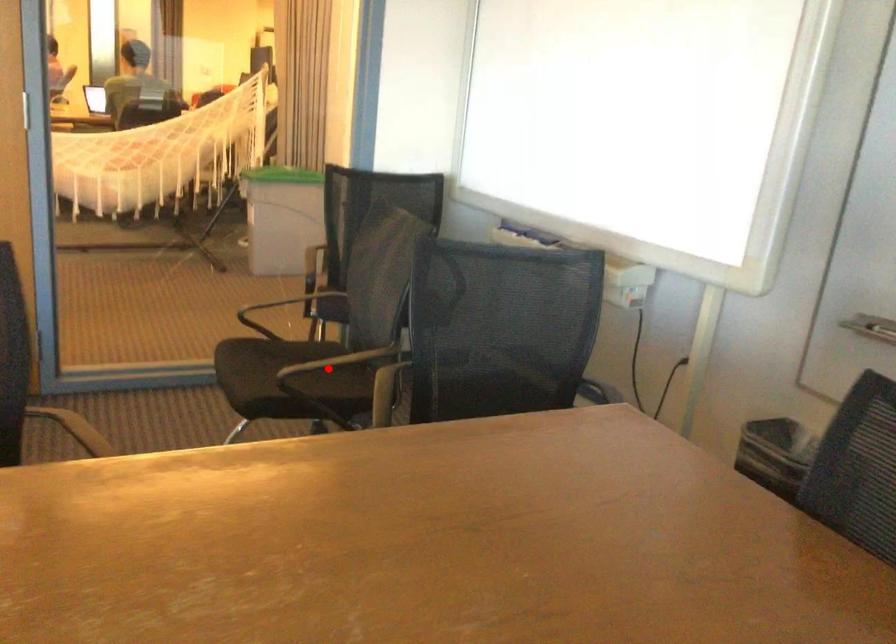
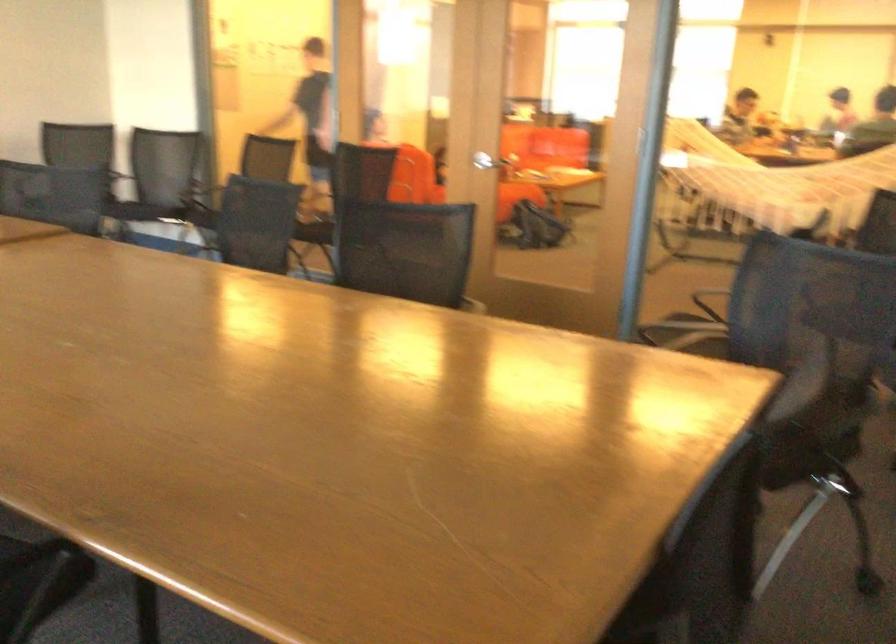
Question: I am providing you with two images of the same scene from different viewpoints. A red point is marked on the first image. Is the red point's position out of view in image 2?

Choices:
 (A) Yes
 (B) No

Answer: (A)